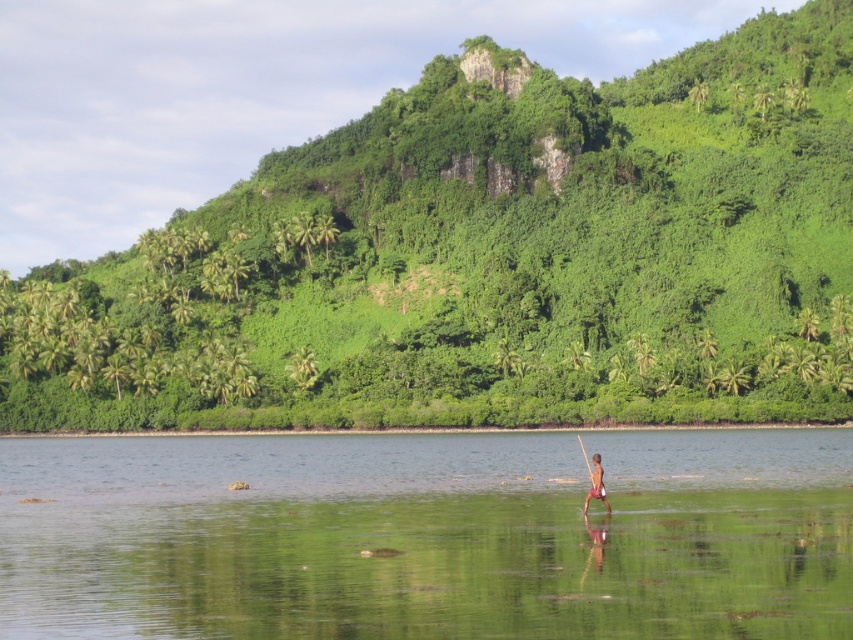
Is green leafy hillside at upper center thinner than clear water at center?

No, green leafy hillside at upper center is not thinner than clear water at center.

Does green leafy hillside at upper center appear on the left side of clear water at center?

Result: No, green leafy hillside at upper center is not to the left of clear water at center.

Between point (535, 230) and point (508, 525), which one is positioned behind?

Point (535, 230)

This screenshot has width=853, height=640. Find the location of `green leafy hillside at upper center`. green leafy hillside at upper center is located at coordinates (489, 259).

Looking at this image, can you confirm if green leafy hillside at upper center is wider than brown skin at center?

Yes, green leafy hillside at upper center is wider than brown skin at center.

From the picture: Is green leafy hillside at upper center above brown skin at center?

Yes.

Identify the location of green leafy hillside at upper center. (489, 259).

Identify the location of green leafy hillside at upper center. (489, 259).

Who is more distant from viewer, (809, 532) or (598, 460)?

The point (598, 460) is more distant.

How distant is clear water at center from brown skin at center?

clear water at center and brown skin at center are 15.32 meters apart from each other.

Locate an element on the screen. This screenshot has width=853, height=640. clear water at center is located at coordinates (427, 536).